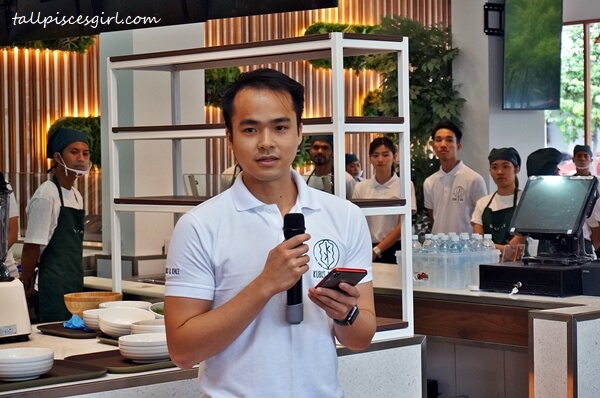
Where is `bowls`? bowls is located at coordinates (18, 362), (148, 347), (118, 321), (88, 296), (91, 315), (152, 324), (159, 309), (139, 305).